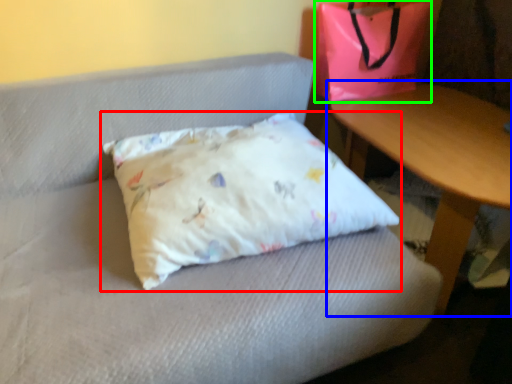
Question: Considering the real-world distances, which object is farthest from pillow (highlighted by a red box)? table (highlighted by a blue box) or pouch (highlighted by a green box)?

Choices:
 (A) table
 (B) pouch

Answer: (B)